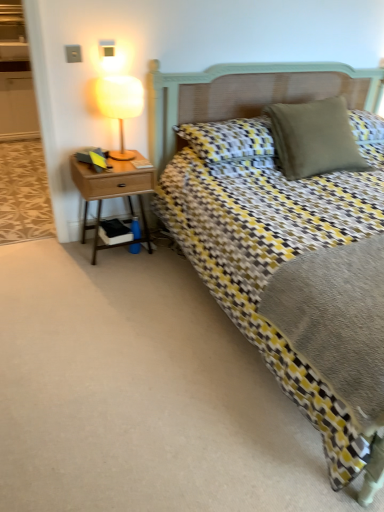
The width and height of the screenshot is (384, 512). Identify the location of vacant space in front of woodennightstand at left. (114, 277).